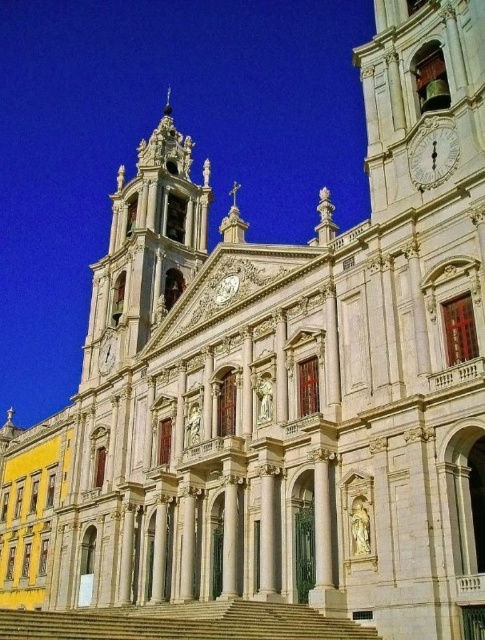
Question: Which point is farther to the camera?

Choices:
 (A) gold ornate clock tower at upper left
 (B) white marble clock at center

Answer: (A)

Question: Does gold ornate clock tower at upper left have a lesser width compared to white marble clock at upper right?

Choices:
 (A) no
 (B) yes

Answer: (A)

Question: Does white marble clock at upper right lie behind white marble clock at center?

Choices:
 (A) yes
 (B) no

Answer: (B)

Question: Which point appears closest to the camera in this image?

Choices:
 (A) (284, 636)
 (B) (106, 362)
 (C) (454, 160)
 (D) (226, 276)

Answer: (A)

Question: Does white marble clock at upper right have a smaller size compared to white textured clock at center?

Choices:
 (A) no
 (B) yes

Answer: (B)

Question: Which of the following is the farthest from the observer?

Choices:
 (A) (443, 140)
 (B) (166, 109)
 (C) (99, 372)
 (D) (193, 636)

Answer: (B)